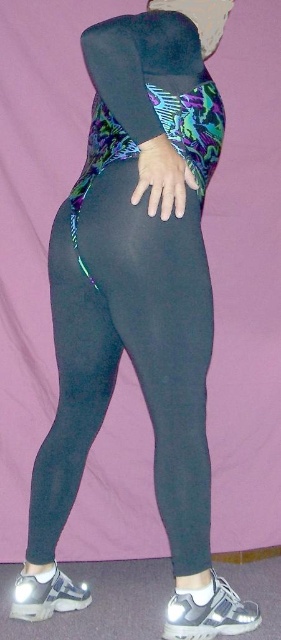
Is black matte leggings at center behind matte black hand at center?

Yes, it is.

Is black matte leggings at center to the right of matte black hand at center from the viewer's perspective?

In fact, black matte leggings at center is to the left of matte black hand at center.

What are the coordinates of `black matte leggings at center` in the screenshot? It's located at (130, 356).

The image size is (281, 640). Find the location of `black matte leggings at center`. black matte leggings at center is located at coordinates (130, 356).